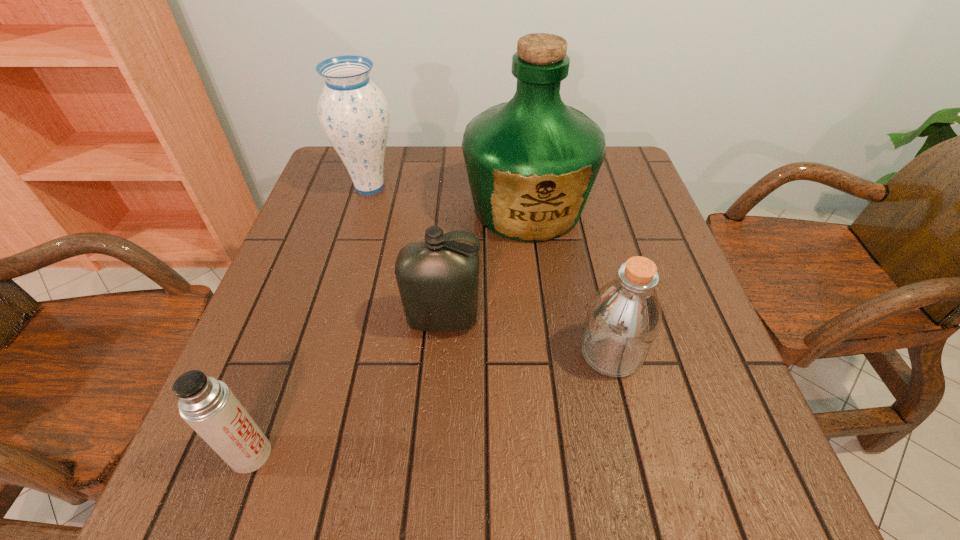
Find the location of `liquor positioned at the far edge`. liquor positioned at the far edge is located at coordinates (531, 162).

Find the location of a particular element. The image size is (960, 540). vase that is at the far edge is located at coordinates (353, 111).

Where is `object situated at the near edge`? object situated at the near edge is located at coordinates pyautogui.click(x=207, y=405).

Find the location of a particular element. This screenshot has width=960, height=540. vase present at the left edge is located at coordinates (353, 111).

I want to click on thermos bottle present at the left edge, so click(x=207, y=405).

Find the location of a particular element. The height and width of the screenshot is (540, 960). liquor that is at the right edge is located at coordinates [x=531, y=162].

Locate an element on the screen. This screenshot has height=540, width=960. bottle present at the right edge is located at coordinates (624, 316).

This screenshot has height=540, width=960. Identify the location of object located at the far left corner. (353, 111).

Where is `object present at the near left corner`? object present at the near left corner is located at coordinates (207, 405).

What are the coordinates of `object that is at the far right corner` in the screenshot? It's located at (531, 162).